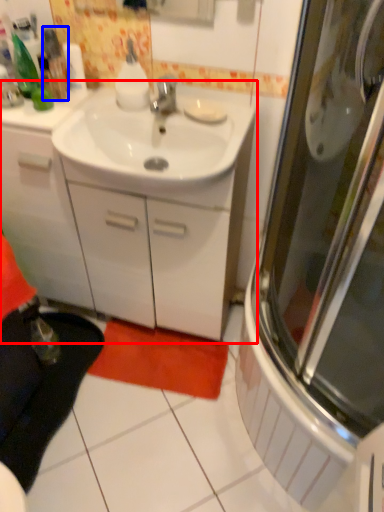
Question: Which object is closer to the camera taking this photo, bathroom cabinet (highlighted by a red box) or bottle (highlighted by a blue box)?

Choices:
 (A) bathroom cabinet
 (B) bottle

Answer: (A)